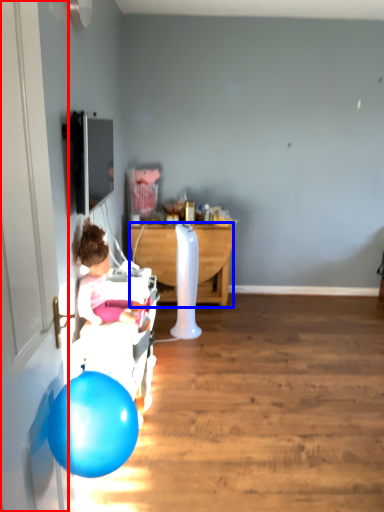
Question: Among these objects, which one is farthest to the camera, door (highlighted by a red box) or desk (highlighted by a blue box)?

Choices:
 (A) door
 (B) desk

Answer: (B)